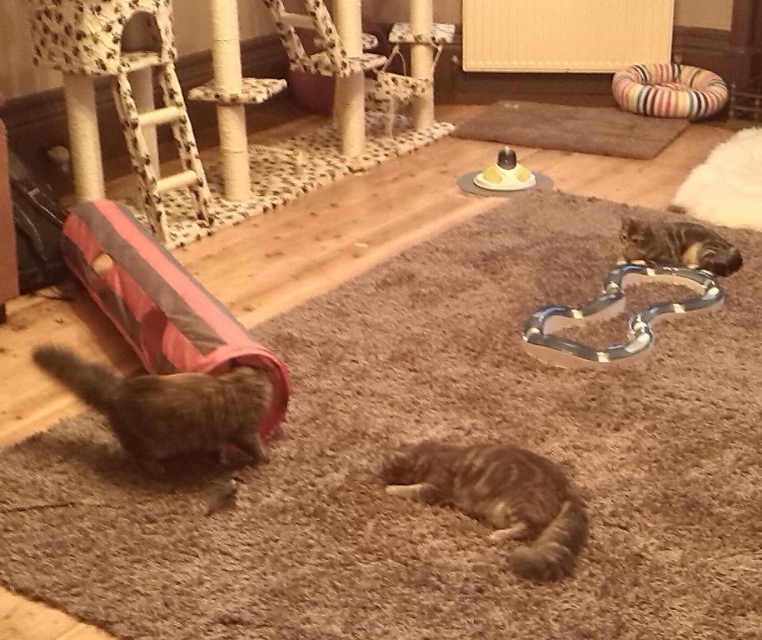
Question: Which point is farther to the camera?

Choices:
 (A) gray tabby cat at center
 (B) yellow rubber ring at center
 (C) gray fur cat at lower left

Answer: (B)

Question: Is striped fur cat at right smaller than yellow rubber ring at center?

Choices:
 (A) yes
 (B) no

Answer: (A)

Question: Which object is closer to the camera taking this photo?

Choices:
 (A) metallic silver chain at upper right
 (B) gray fur cat at lower left
 (C) yellow rubber ring at center
 (D) striped fur cat at right

Answer: (B)

Question: Is metallic silver chain at upper right above striped fur cat at right?

Choices:
 (A) yes
 (B) no

Answer: (B)

Question: Which is nearer to the metallic silver chain at upper right?

Choices:
 (A) gray fur cat at lower left
 (B) gray tabby cat at center

Answer: (B)

Question: In this image, where is gray fur cat at lower left located relative to striped fur cat at right?

Choices:
 (A) below
 (B) above

Answer: (A)